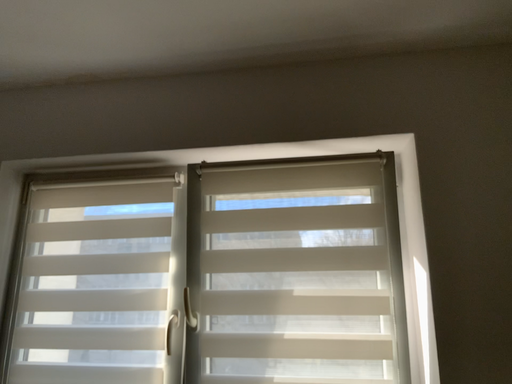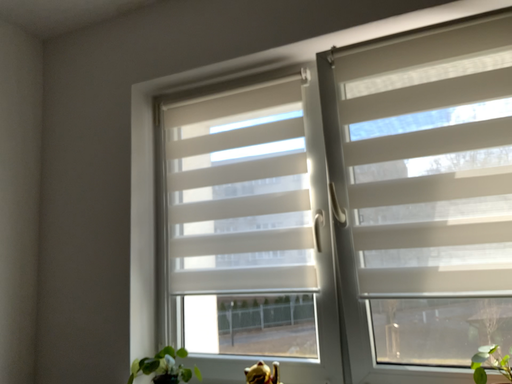
Question: How did the camera likely rotate when shooting the video?

Choices:
 (A) rotated upward
 (B) rotated downward

Answer: (B)